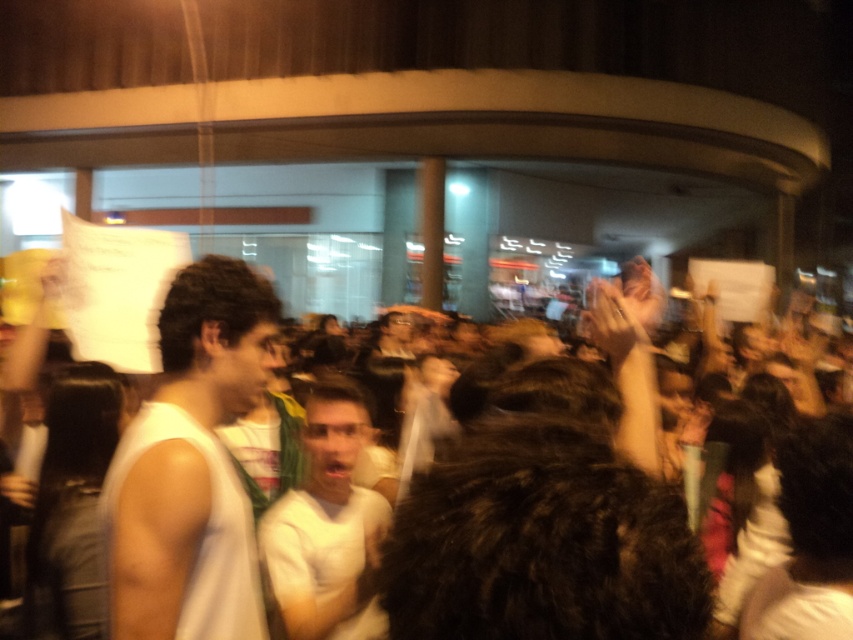
Question: Which is farther from the white matte shirt at center?

Choices:
 (A) white fur coat at center
 (B) white fabric shirt at center

Answer: (B)

Question: Which point appears farthest from the camera in this image?

Choices:
 (A) (318, 445)
 (B) (151, 588)

Answer: (A)

Question: Can you confirm if white fur coat at center is wider than white matte shirt at center?

Choices:
 (A) no
 (B) yes

Answer: (B)

Question: Is white fur coat at center thinner than white matte shirt at center?

Choices:
 (A) yes
 (B) no

Answer: (B)

Question: Which object is farther from the camera taking this photo?

Choices:
 (A) white matte shirt at center
 (B) white fur coat at center
 (C) white fabric shirt at center

Answer: (A)

Question: Does white fur coat at center appear under white matte shirt at center?

Choices:
 (A) yes
 (B) no

Answer: (B)